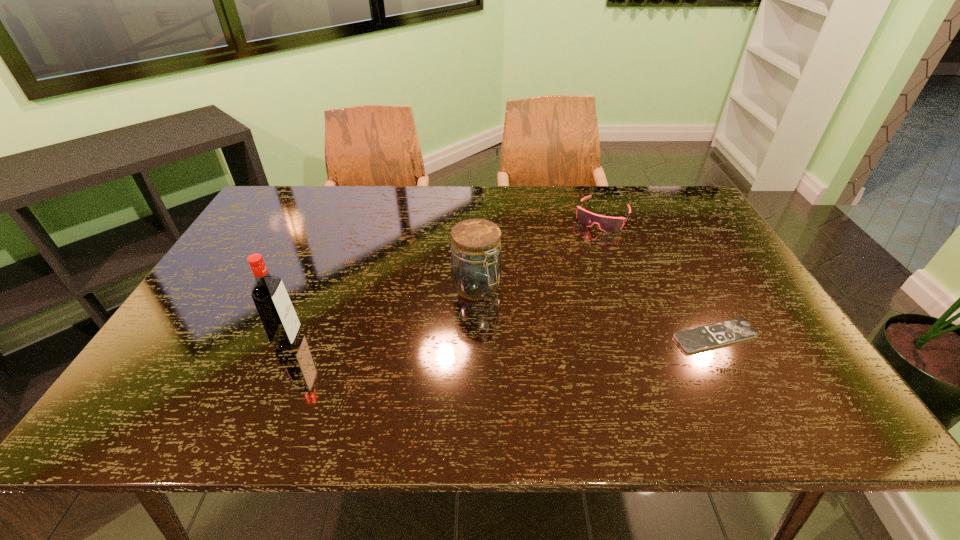
Where is `vacant space located 0.120m on the lid of the third shortest object`? This screenshot has width=960, height=540. vacant space located 0.120m on the lid of the third shortest object is located at coordinates (516, 333).

Image resolution: width=960 pixels, height=540 pixels. What are the coordinates of `blank space located 0.170m on the lid of the third shortest object` in the screenshot? It's located at (527, 347).

Locate an element on the screen. This screenshot has height=540, width=960. free space located 0.290m on the front-facing side of the third tallest object is located at coordinates (564, 286).

The image size is (960, 540). Identify the location of vacant region located 0.130m on the front-facing side of the third tallest object. (582, 254).

At what (x,y) coordinates should I click in order to perform the action: click on vacant region located on the front-facing side of the third tallest object. Please return your answer as a coordinate pair (x, y). Looking at the image, I should click on (569, 275).

Where is `object that is at the far edge`? This screenshot has height=540, width=960. object that is at the far edge is located at coordinates (607, 224).

The width and height of the screenshot is (960, 540). In order to click on vodka at the near edge in this screenshot , I will do `click(281, 324)`.

The width and height of the screenshot is (960, 540). I want to click on remote control at the near edge, so click(700, 338).

At what (x,y) coordinates should I click in order to perform the action: click on object at the right edge. Please return your answer as a coordinate pair (x, y). Looking at the image, I should click on (700, 338).

Identify the location of object located at the near right corner. (700, 338).